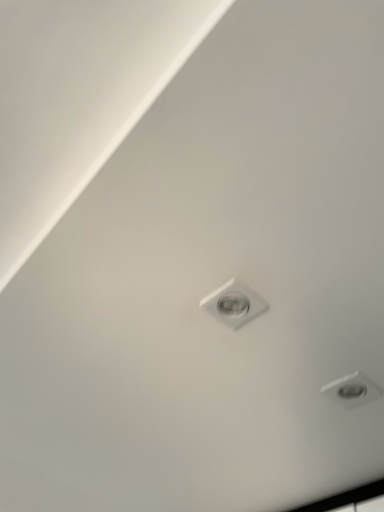
Describe the element at coordinates (353, 389) in the screenshot. I see `matte white droplight at lower right` at that location.

Locate an element on the screen. The width and height of the screenshot is (384, 512). matte white droplight at lower right is located at coordinates (353, 389).

The image size is (384, 512). What do you see at coordinates (234, 303) in the screenshot?
I see `white glossy light bulb at center` at bounding box center [234, 303].

I want to click on white glossy light bulb at center, so click(234, 303).

Locate an element on the screen. The height and width of the screenshot is (512, 384). matte white droplight at lower right is located at coordinates point(353,389).

Considering the positions of objects matte white droplight at lower right and white glossy light bulb at center in the image provided, who is more to the left, matte white droplight at lower right or white glossy light bulb at center?

From the viewer's perspective, white glossy light bulb at center appears more on the left side.

Between matte white droplight at lower right and white glossy light bulb at center, which one is positioned behind?

matte white droplight at lower right.

Is point (343, 392) positioned after point (232, 319)?

Yes, it is.

From the image's perspective, is matte white droplight at lower right below white glossy light bulb at center?

Indeed, from the image's perspective, matte white droplight at lower right is shown beneath white glossy light bulb at center.

From a real-world perspective, which object rests below the other?

matte white droplight at lower right, from a real-world perspective.

Which object is thinner, matte white droplight at lower right or white glossy light bulb at center?

matte white droplight at lower right is thinner.

Does matte white droplight at lower right have a lesser height compared to white glossy light bulb at center?

Indeed, matte white droplight at lower right has a lesser height compared to white glossy light bulb at center.

Which of these two, matte white droplight at lower right or white glossy light bulb at center, is bigger?

white glossy light bulb at center.

Is matte white droplight at lower right located outside white glossy light bulb at center?

Indeed, matte white droplight at lower right is completely outside white glossy light bulb at center.

Are matte white droplight at lower right and white glossy light bulb at center far apart?

No.

Is matte white droplight at lower right turned away from white glossy light bulb at center?

matte white droplight at lower right is not turned away from white glossy light bulb at center.

The height and width of the screenshot is (512, 384). Find the location of `light bulb above the matte white droplight at lower right (from a real-world perspective)`. light bulb above the matte white droplight at lower right (from a real-world perspective) is located at coordinates (234, 303).

Looking at this image, based on their positions, is white glossy light bulb at center located to the left or right of matte white droplight at lower right?

white glossy light bulb at center is to the left of matte white droplight at lower right.

Which object is further away from the camera taking this photo, white glossy light bulb at center or matte white droplight at lower right?

matte white droplight at lower right is more distant.

Based on the photo, which is less distant, (222,316) or (377,394)?

Point (222,316)

From the image's perspective, is white glossy light bulb at center located above or below matte white droplight at lower right?

white glossy light bulb at center is above matte white droplight at lower right.

From a real-world perspective, is white glossy light bulb at center beneath matte white droplight at lower right?

No, from a real-world perspective, white glossy light bulb at center is not under matte white droplight at lower right.

In the scene shown: Between white glossy light bulb at center and matte white droplight at lower right, which one has smaller width?

matte white droplight at lower right is thinner.

Which of these two, white glossy light bulb at center or matte white droplight at lower right, stands shorter?

With less height is matte white droplight at lower right.

In the scene shown: Is white glossy light bulb at center smaller than matte white droplight at lower right?

Actually, white glossy light bulb at center might be larger than matte white droplight at lower right.

From the picture: Is white glossy light bulb at center spatially inside matte white droplight at lower right, or outside of it?

white glossy light bulb at center is located beyond the bounds of matte white droplight at lower right.

Looking at this image, would you say white glossy light bulb at center is a long distance from matte white droplight at lower right?

That's not correct — white glossy light bulb at center is a little close to matte white droplight at lower right.

Could you tell me if white glossy light bulb at center is turned towards matte white droplight at lower right?

No, white glossy light bulb at center is not turned towards matte white droplight at lower right.

How different are the orientations of white glossy light bulb at center and matte white droplight at lower right in degrees?

white glossy light bulb at center and matte white droplight at lower right are facing 0.686 degrees away from each other.

In the image, there is a white glossy light bulb at center. Identify the location of droplight below it (from a real-world perspective). This screenshot has width=384, height=512. (353, 389).

The height and width of the screenshot is (512, 384). I want to click on droplight directly beneath the white glossy light bulb at center (from a real-world perspective), so [353, 389].

Find the location of a particular element. droplight behind the white glossy light bulb at center is located at coordinates (353, 389).